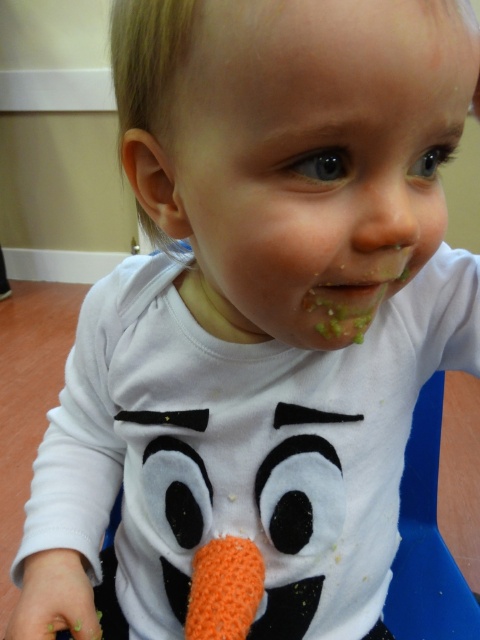
Based on the scene described, can you determine which object is bigger between the smooth white face at center and the orange knitted carrot at lower center?

The smooth white face at center has a larger size compared to the orange knitted carrot at lower center, so the smooth white face at center is bigger.

The child in the image is looking at two objects. One is the smooth white face at center and the other is the orange knitted carrot at lower center. Which of these two objects is wider?

The smooth white face at center is wider than the orange knitted carrot at lower center.

You are a photographer setting up a shot of the child in the image. You need to position a small light source to highlight both the smooth white face at center and the orange knitted carrot at lower center. Given their positions, where should you place the light source relative to the child?

The smooth white face at center is above the orange knitted carrot at lower center, so placing the light source above the child would illuminate both areas effectively, casting a natural shadow downward.